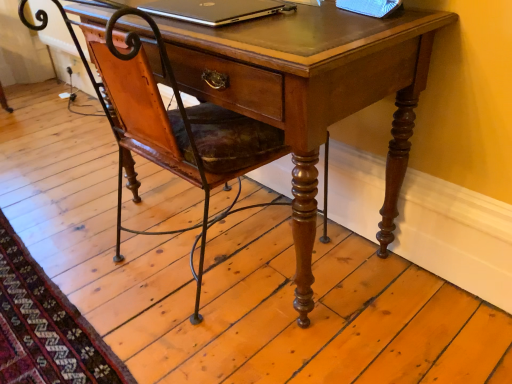
Identify the location of wooden desk at center. This screenshot has height=384, width=512. (312, 92).

What do you see at coordinates (312, 92) in the screenshot? The width and height of the screenshot is (512, 384). I see `wooden desk at center` at bounding box center [312, 92].

What is the approximate width of silver metallic laptop at upper center?

silver metallic laptop at upper center is 9.96 inches wide.

Describe the element at coordinates (215, 10) in the screenshot. I see `silver metallic laptop at upper center` at that location.

Image resolution: width=512 pixels, height=384 pixels. Identify the location of silver metallic laptop at upper center. point(215,10).

Locate an element on the screen. The width and height of the screenshot is (512, 384). wooden desk at center is located at coordinates (312, 92).

Considering the relative positions of silver metallic laptop at upper center and wooden desk at center in the image provided, is silver metallic laptop at upper center to the left of wooden desk at center from the viewer's perspective?

Correct, you'll find silver metallic laptop at upper center to the left of wooden desk at center.

Is the position of silver metallic laptop at upper center more distant than that of wooden desk at center?

Yes, silver metallic laptop at upper center is further from the camera.

Is point (151, 9) positioned after point (288, 82)?

Yes, point (151, 9) is farther from viewer.

From the image's perspective, is silver metallic laptop at upper center on top of wooden desk at center?

Indeed, from the image's perspective, silver metallic laptop at upper center is shown above wooden desk at center.

From the picture: From a real-world perspective, between silver metallic laptop at upper center and wooden desk at center, who is vertically lower?

From a 3D spatial view, wooden desk at center is below.

Based on the photo, which of these two, silver metallic laptop at upper center or wooden desk at center, is thinner?

Thinner between the two is silver metallic laptop at upper center.

Is silver metallic laptop at upper center taller than wooden desk at center?

No.

Considering the sizes of objects silver metallic laptop at upper center and wooden desk at center in the image provided, who is smaller, silver metallic laptop at upper center or wooden desk at center?

silver metallic laptop at upper center is smaller.

Can we say silver metallic laptop at upper center lies outside wooden desk at center?

No, silver metallic laptop at upper center is not entirely external to wooden desk at center.

Is silver metallic laptop at upper center touching wooden desk at center?

silver metallic laptop at upper center and wooden desk at center are clearly separated.

Is silver metallic laptop at upper center turned away from wooden desk at center?

Yes, silver metallic laptop at upper center is facing away from wooden desk at center.

How different are the orientations of silver metallic laptop at upper center and wooden desk at center in degrees?

The angle between the facing direction of silver metallic laptop at upper center and the facing direction of wooden desk at center is 0.0432 degrees.

Looking at this image, how much distance is there between silver metallic laptop at upper center and wooden desk at center?

silver metallic laptop at upper center is 25.94 centimeters from wooden desk at center.

I want to click on laptop to the left of wooden desk at center, so coord(215,10).

Does wooden desk at center appear on the right side of silver metallic laptop at upper center?

Correct, you'll find wooden desk at center to the right of silver metallic laptop at upper center.

Which object is further away from the camera, wooden desk at center or silver metallic laptop at upper center?

silver metallic laptop at upper center.

Considering the points (183, 56) and (279, 7), which point is behind, point (183, 56) or point (279, 7)?

Positioned behind is point (279, 7).

From the image's perspective, would you say wooden desk at center is shown under silver metallic laptop at upper center?

Indeed, from the image's perspective, wooden desk at center is shown beneath silver metallic laptop at upper center.

Consider the image. From a real-world perspective, is wooden desk at center below silver metallic laptop at upper center?

Yes, from a real-world perspective, wooden desk at center is beneath silver metallic laptop at upper center.

Between wooden desk at center and silver metallic laptop at upper center, which one has smaller width?

Thinner between the two is silver metallic laptop at upper center.

Consider the image. Is wooden desk at center taller or shorter than silver metallic laptop at upper center?

In the image, wooden desk at center appears to be taller than silver metallic laptop at upper center.

Considering the relative sizes of wooden desk at center and silver metallic laptop at upper center in the image provided, is wooden desk at center smaller than silver metallic laptop at upper center?

Actually, wooden desk at center might be larger than silver metallic laptop at upper center.

Choose the correct answer: Is wooden desk at center inside silver metallic laptop at upper center or outside it?

wooden desk at center is outside silver metallic laptop at upper center.

Is wooden desk at center with silver metallic laptop at upper center?

No, wooden desk at center is not touching silver metallic laptop at upper center.

Looking at this image, is wooden desk at center positioned with its back to silver metallic laptop at upper center?

No, wooden desk at center's orientation is not away from silver metallic laptop at upper center.

How many degrees apart are the facing directions of wooden desk at center and silver metallic laptop at upper center?

0.0432 degrees separate the facing orientations of wooden desk at center and silver metallic laptop at upper center.

Where is `desk that appears on the right of silver metallic laptop at upper center`? Image resolution: width=512 pixels, height=384 pixels. desk that appears on the right of silver metallic laptop at upper center is located at coordinates (312, 92).

You are a GUI agent. You are given a task and a screenshot of the screen. Output one action in this format:
    pyautogui.click(x=<x>, y=<y>)
    Task: Click on the desk in front of the silver metallic laptop at upper center
    
    Given the screenshot: What is the action you would take?
    pyautogui.click(x=312, y=92)

Identify the location of laptop on the left of wooden desk at center. This screenshot has height=384, width=512. (215, 10).